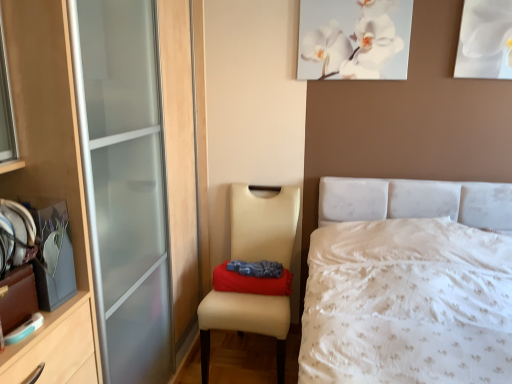
Question: From the image's perspective, relative to white paper at upper right, which appears as the second picture frame when viewed from the left, is white canvas at upper center, acting as the first picture frame starting from the left, above or below?

Choices:
 (A) above
 (B) below

Answer: (A)

Question: Is point [325, 64] positioned closer to the camera than point [483, 56]?

Choices:
 (A) closer
 (B) farther

Answer: (B)

Question: Which object is positioned closest to the beige leather chair at lower left?

Choices:
 (A) white canvas at upper center, which is the 2th picture frame from right to left
 (B) red fabric pillow at center
 (C) white textured bed at center
 (D) white paper at upper right, which appears as the second picture frame when viewed from the left

Answer: (B)

Question: Based on their relative distances, which object is nearer to the white paper at upper right, which appears as the second picture frame when viewed from the left?

Choices:
 (A) white textured bed at center
 (B) beige leather chair at lower left
 (C) red fabric pillow at center
 (D) white canvas at upper center, acting as the first picture frame starting from the left

Answer: (D)